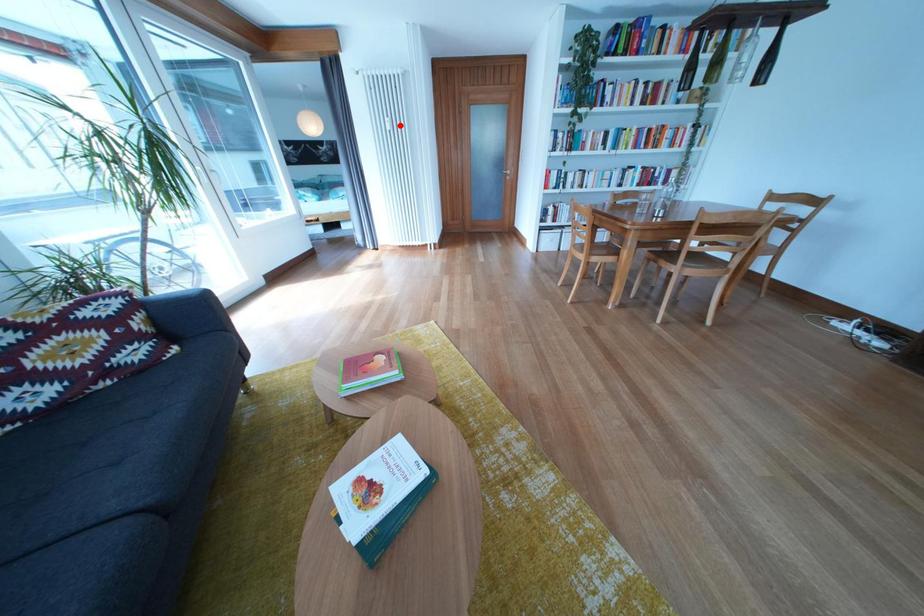
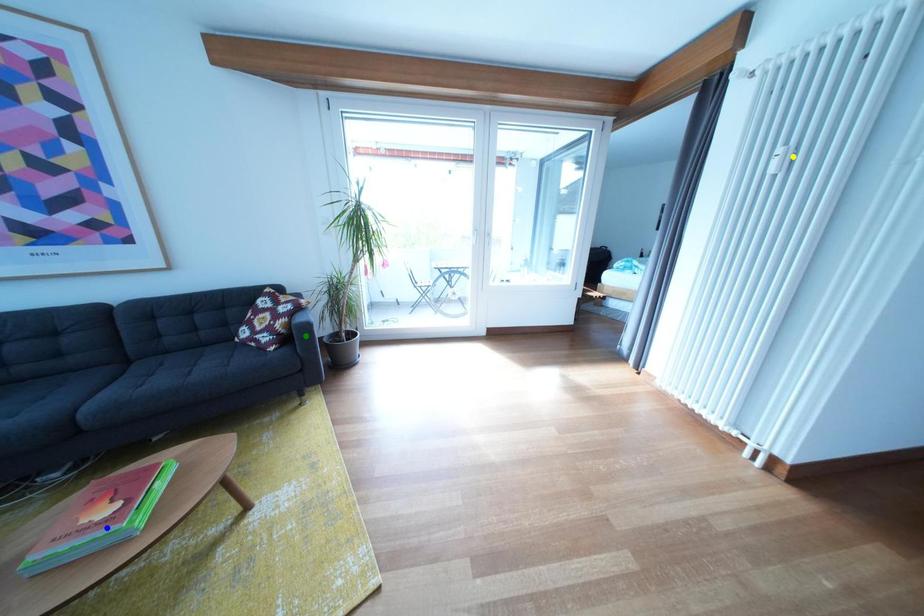
Question: I am providing you with two images of the same scene from different viewpoints. A red point is marked on the first image. You are given multiple points on the second image. Which point in image 2 is actually the same real-world point as the red point in image 1?

Choices:
 (A) blue point
 (B) green point
 (C) yellow point

Answer: (C)